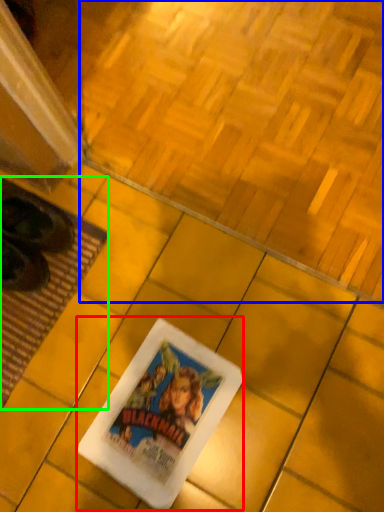
Question: Based on their relative distances, which object is nearer to movie poster (highlighted by a red box)? Choose from square (highlighted by a blue box) and mat (highlighted by a green box).

Choices:
 (A) square
 (B) mat

Answer: (B)